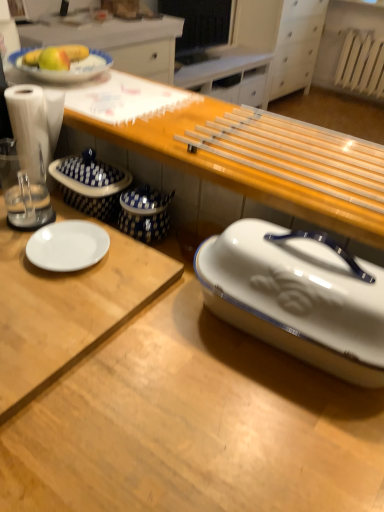
At what (x,y) coordinates should I click in order to perform the action: click on white glossy plate at left, which is the 2th desk from bottom to top. Please return your answer as a coordinate pair (x, y). The width and height of the screenshot is (384, 512). Looking at the image, I should click on coord(67,308).

What do you see at coordinates (193, 425) in the screenshot? I see `white glossy desk at center, the 2th desk in the top-to-bottom sequence` at bounding box center [193, 425].

The width and height of the screenshot is (384, 512). In order to click on yellow matte apple at upper left in this screenshot , I will do `click(54, 59)`.

Image resolution: width=384 pixels, height=512 pixels. What do you see at coordinates (297, 298) in the screenshot?
I see `white glossy breadbox at lower right` at bounding box center [297, 298].

Measure the distance between point (x=337, y=289) and camera.

The distance of point (x=337, y=289) from camera is 23.11 inches.

Measure the distance between wooden table at center and camera.

wooden table at center is 24.19 inches away from camera.

Image resolution: width=384 pixels, height=512 pixels. I want to click on white plastic radiator at upper right, so click(x=361, y=65).

Which of these two, white plastic radiator at upper right or transparent plastic blender at left, is wider?

white plastic radiator at upper right is wider.

Is white plastic radiator at upper right with transparent plastic blender at left?

white plastic radiator at upper right and transparent plastic blender at left are clearly separated.

Considering the positions of objects white plastic radiator at upper right and transparent plastic blender at left in the image provided, who is more to the right, white plastic radiator at upper right or transparent plastic blender at left?

white plastic radiator at upper right is more to the right.

From their relative heights in the image, would you say white plastic radiator at upper right is taller or shorter than transparent plastic blender at left?

In the image, white plastic radiator at upper right appears to be taller than transparent plastic blender at left.

From a real-world perspective, relative to white glossy plate at left, the 1th desk positioned from the top, is yellow matte apple at upper left vertically above or below?

From a real-world perspective, yellow matte apple at upper left is physically above white glossy plate at left, the 1th desk positioned from the top.

Considering the points (59, 70) and (65, 312), which point is behind, point (59, 70) or point (65, 312)?

Positioned behind is point (59, 70).

Based on the photo, which object is further away from the camera taking this photo, yellow matte apple at upper left or white glossy plate at left, the 1th desk positioned from the top?

yellow matte apple at upper left is further away from the camera.

In terms of width, does yellow matte apple at upper left look wider or thinner when compared to white glossy plate at left, which is the 2th desk from bottom to top?

In the image, yellow matte apple at upper left appears to be more narrow than white glossy plate at left, which is the 2th desk from bottom to top.

From the image's perspective, which one is positioned lower, white glossy breadbox at lower right or white plastic radiator at upper right?

white glossy breadbox at lower right is shown below in the image.

Is white glossy breadbox at lower right oriented towards white plastic radiator at upper right?

No, white glossy breadbox at lower right is not facing towards white plastic radiator at upper right.

How far apart are white glossy breadbox at lower right and white plastic radiator at upper right?

white glossy breadbox at lower right and white plastic radiator at upper right are 4.57 meters apart.

Which of these two, white glossy breadbox at lower right or white plastic radiator at upper right, is wider?

With larger width is white plastic radiator at upper right.

Does transparent plastic blender at left touch wooden table at center?

No, transparent plastic blender at left is not beside wooden table at center.

Is transparent plastic blender at left not within wooden table at center?

transparent plastic blender at left lies outside wooden table at center's area.

Who is smaller, transparent plastic blender at left or wooden table at center?

transparent plastic blender at left is smaller.

From a real-world perspective, which object rests below the other?

transparent plastic blender at left is physically lower.

Considering the sizes of wooden table at center and yellow matte apple at upper left in the image, is wooden table at center taller or shorter than yellow matte apple at upper left?

Clearly, wooden table at center is taller compared to yellow matte apple at upper left.

Based on the photo, considering the relative sizes of wooden table at center and yellow matte apple at upper left in the image provided, is wooden table at center thinner than yellow matte apple at upper left?

No.

Looking at the image, does wooden table at center seem bigger or smaller compared to yellow matte apple at upper left?

wooden table at center is bigger than yellow matte apple at upper left.

From a real-world perspective, is wooden table at center located beneath yellow matte apple at upper left?

Indeed, from a real-world perspective, wooden table at center is positioned beneath yellow matte apple at upper left.

Is there a large distance between white glossy breadbox at lower right and wooden table at center?

white glossy breadbox at lower right is near wooden table at center, not far away.

Find the location of a particular element. Image resolution: width=384 pixels, height=512 pixels. tableware on the right of wooden table at center is located at coordinates (297, 298).

Between point (288, 301) and point (72, 114), which one is positioned in front?

Positioned in front is point (288, 301).

Is white glossy desk at center, the 2th desk in the top-to-bottom sequence, located outside wooden table at center?

Yes, white glossy desk at center, the 2th desk in the top-to-bottom sequence, is not within wooden table at center.

Based on their positions, is white glossy desk at center, the 2th desk in the top-to-bottom sequence, located to the left or right of wooden table at center?

white glossy desk at center, the 2th desk in the top-to-bottom sequence, is to the left of wooden table at center.

Considering the sizes of white glossy desk at center, which is counted as the first desk, starting from the bottom, and wooden table at center in the image, is white glossy desk at center, which is counted as the first desk, starting from the bottom, bigger or smaller than wooden table at center?

white glossy desk at center, which is counted as the first desk, starting from the bottom, is bigger than wooden table at center.

Where is `radiator on the right side of transparent plastic blender at left`? This screenshot has width=384, height=512. radiator on the right side of transparent plastic blender at left is located at coordinates (361, 65).

Identify the location of apple located above the white glossy plate at left, which is the 2th desk from bottom to top (from a real-world perspective). (54, 59).

Considering their positions, is transparent plastic blender at left positioned further to white plastic radiator at upper right than white glossy breadbox at lower right?

Among the two, white glossy breadbox at lower right is located further to white plastic radiator at upper right.

When comparing their distances from transparent plastic blender at left, does white glossy desk at center, which is counted as the first desk, starting from the bottom, or wooden table at center seem further?

Based on the image, white glossy desk at center, which is counted as the first desk, starting from the bottom, appears to be further to transparent plastic blender at left.

Looking at the image, which one is located further to white plastic radiator at upper right, wooden table at center or white glossy breadbox at lower right?

white glossy breadbox at lower right is further to white plastic radiator at upper right.

Considering their positions, is wooden table at center positioned closer to white glossy breadbox at lower right than white glossy desk at center, which is counted as the first desk, starting from the bottom?

white glossy desk at center, which is counted as the first desk, starting from the bottom, lies closer to white glossy breadbox at lower right than the other object.

Based on their spatial positions, is white glossy plate at left, the 1th desk positioned from the top, or white plastic radiator at upper right closer to transparent plastic blender at left?

Among the two, white glossy plate at left, the 1th desk positioned from the top, is located nearer to transparent plastic blender at left.

Which object lies nearer to the anchor point wooden table at center, transparent plastic blender at left or white glossy breadbox at lower right?

white glossy breadbox at lower right is positioned closer to the anchor wooden table at center.

When comparing their distances from white plastic radiator at upper right, does white glossy plate at left, the 1th desk positioned from the top, or yellow matte apple at upper left seem further?

white glossy plate at left, the 1th desk positioned from the top.

Which object lies further to the anchor point white glossy breadbox at lower right, wooden table at center or white glossy plate at left, the 1th desk positioned from the top?

white glossy plate at left, the 1th desk positioned from the top, is positioned further to the anchor white glossy breadbox at lower right.

Where is `apple between transparent plastic blender at left and white plastic radiator at upper right along the z-axis`? The image size is (384, 512). apple between transparent plastic blender at left and white plastic radiator at upper right along the z-axis is located at coordinates (54, 59).

The width and height of the screenshot is (384, 512). What are the coordinates of `tableware between white glossy desk at center, the 2th desk in the top-to-bottom sequence, and white plastic radiator at upper right from front to back` in the screenshot? It's located at (297, 298).

Where is `desk between white glossy breadbox at lower right and white plastic radiator at upper right from front to back`? This screenshot has height=512, width=384. desk between white glossy breadbox at lower right and white plastic radiator at upper right from front to back is located at coordinates (67, 308).

You are a GUI agent. You are given a task and a screenshot of the screen. Output one action in this format:
    pyautogui.click(x=<x>, y=<y>)
    Task: Click on the blender that lies between wooden table at center and white glossy desk at center, which is counted as the first desk, starting from the bottom, from top to bottom
    
    Given the screenshot: What is the action you would take?
    pyautogui.click(x=30, y=155)